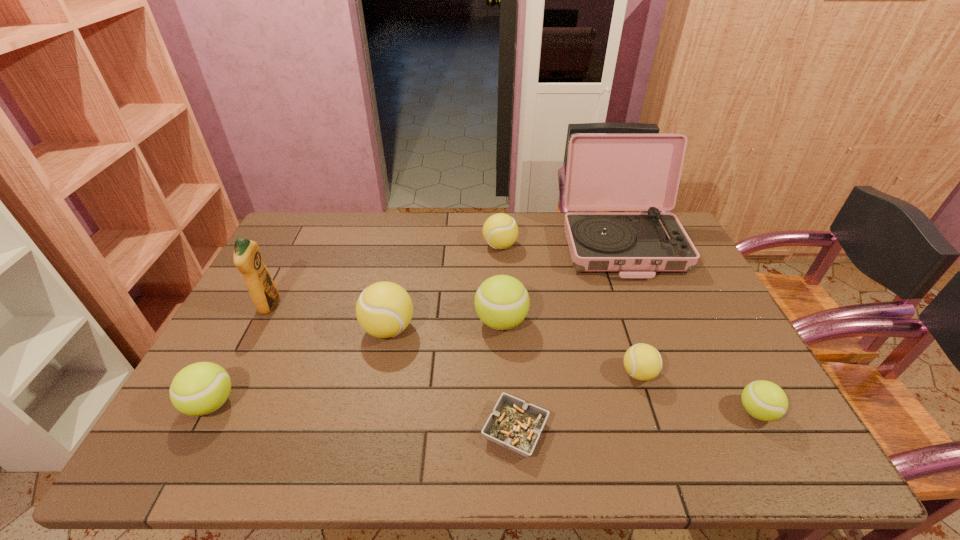
This screenshot has height=540, width=960. What are the coordinates of `vacant area that satisfies the following two spatial constraints: 1. with the lid open on the rightmost tennis ball; 2. on the left side of the record player` in the screenshot? It's located at (688, 411).

I want to click on vacant area that satisfies the following two spatial constraints: 1. on the label of the shortest object; 2. on the left side of the detergent, so click(x=205, y=430).

Find the location of a particular element. Image resolution: width=960 pixels, height=540 pixels. free space in the image that satisfies the following two spatial constraints: 1. on the label of the second tallest object; 2. on the front side of the leftmost tennis ball is located at coordinates (219, 403).

What are the coordinates of `vacant space that satisfies the following two spatial constraints: 1. on the label of the detergent; 2. on the left side of the ashtray` in the screenshot? It's located at (205, 430).

Image resolution: width=960 pixels, height=540 pixels. What are the coordinates of `free space that satisfies the following two spatial constraints: 1. on the back side of the second smallest yellow tennis ball; 2. on the left side of the third object from left to right` in the screenshot? It's located at (406, 246).